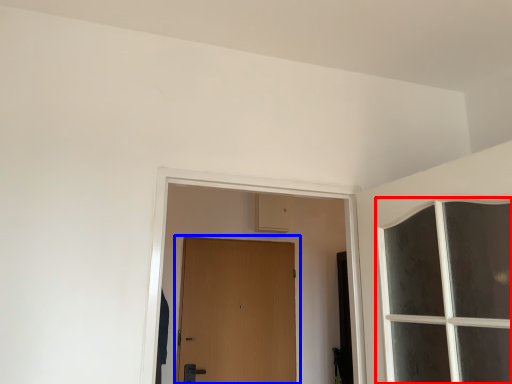
Question: Which object appears farthest to the camera in this image, window (highlighted by a red box) or door (highlighted by a blue box)?

Choices:
 (A) window
 (B) door

Answer: (B)